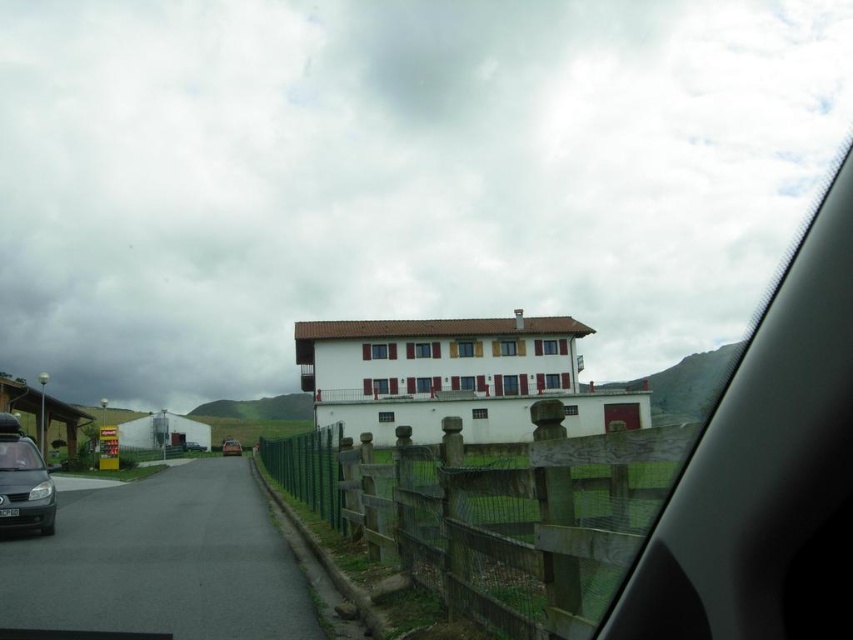
You are inside a car and looking out the window. You see a point marked at coordinates (22, 481). Which object is this point located on?

The point is located on the matte gray car at left.

You are driving a car and you see the wooden at center and the matte black car at center from inside your vehicle. Which object appears taller when viewed through the car window?

The wooden at center appears taller than the matte black car at center because it has a greater height.

You are driving a car and want to park near the wooden at center. However, there is a matte black car at center already occupying the space. Based on their sizes, can you fit your car there without overlapping?

The wooden at center is larger than the matte black car at center, so if your car is smaller than the wooden at center, it might fit in the space. However, since the matte black car is already there, you need to consider both vehicles. If the combined size of both vehicles exceeds the available space, you might not fit. But since the wooden at center is larger, there might be enough space if the matte black car is moved.